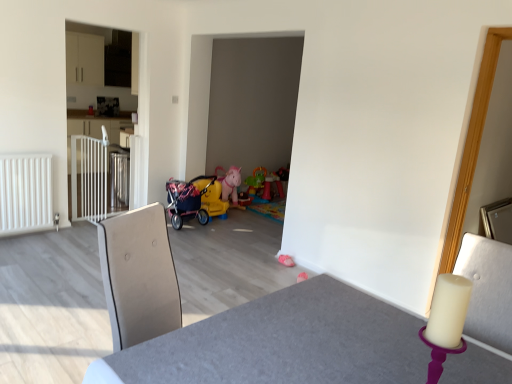
Locate an element on the screen. vacant area that lies in front of white matte radiator at left is located at coordinates (23, 247).